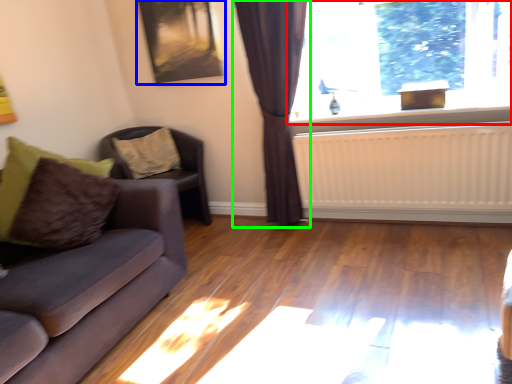
Question: Estimate the real-world distances between objects in this image. Which object is farther from window (highlighted by a red box), picture frame (highlighted by a blue box) or curtain (highlighted by a green box)?

Choices:
 (A) picture frame
 (B) curtain

Answer: (A)